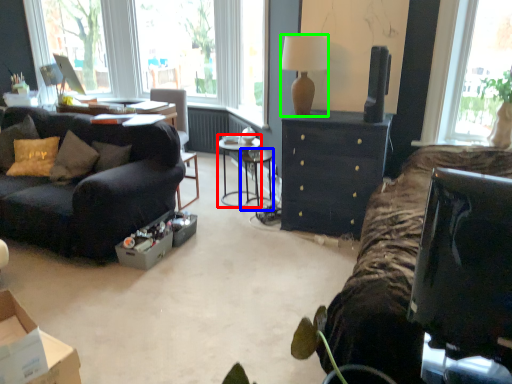
Question: Which object is positioned closest to side table (highlighted by a red box)? Select from table (highlighted by a blue box) and lamp (highlighted by a green box).

Choices:
 (A) table
 (B) lamp

Answer: (A)